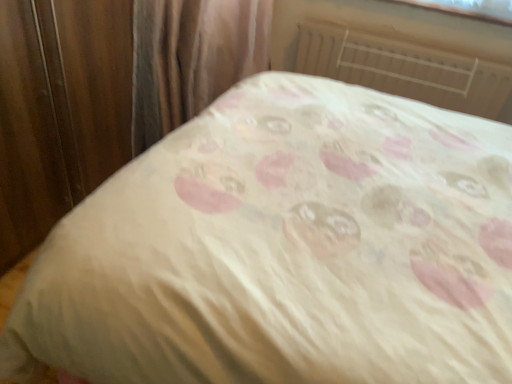
Describe the element at coordinates (404, 69) in the screenshot. The image size is (512, 384). I see `white plastic radiator at upper center` at that location.

This screenshot has width=512, height=384. Identify the location of white plastic radiator at upper center. (404, 69).

Locate an element on the screen. white plastic radiator at upper center is located at coordinates (404, 69).